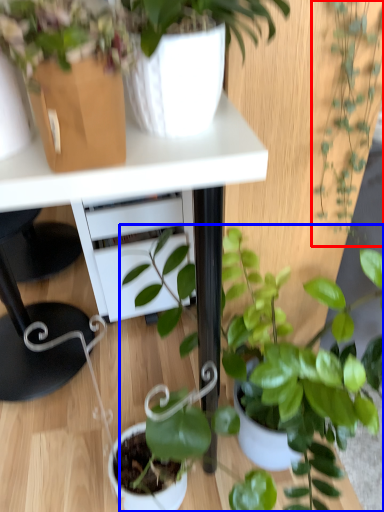
Question: Among these objects, which one is farthest to the camera, houseplant (highlighted by a red box) or houseplant (highlighted by a blue box)?

Choices:
 (A) houseplant
 (B) houseplant

Answer: (A)